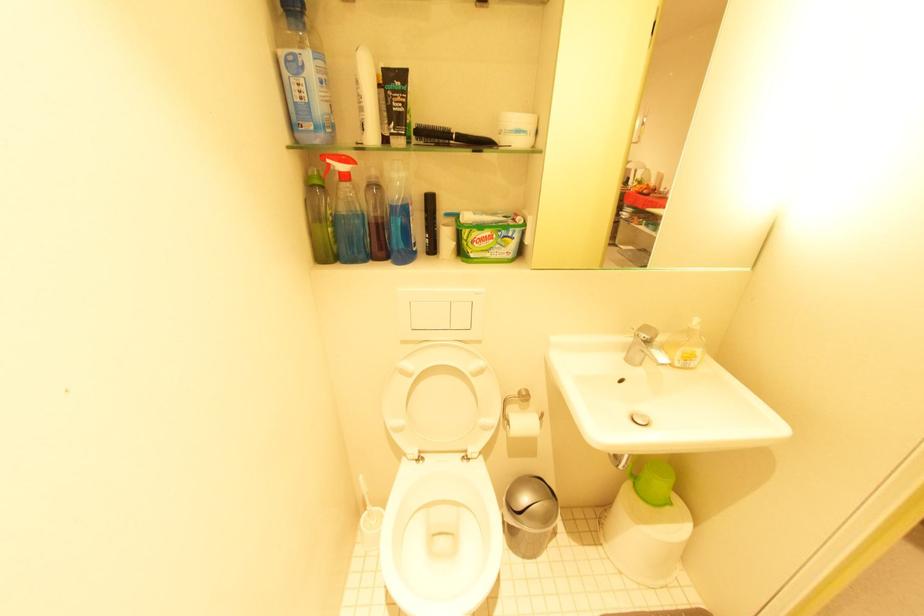
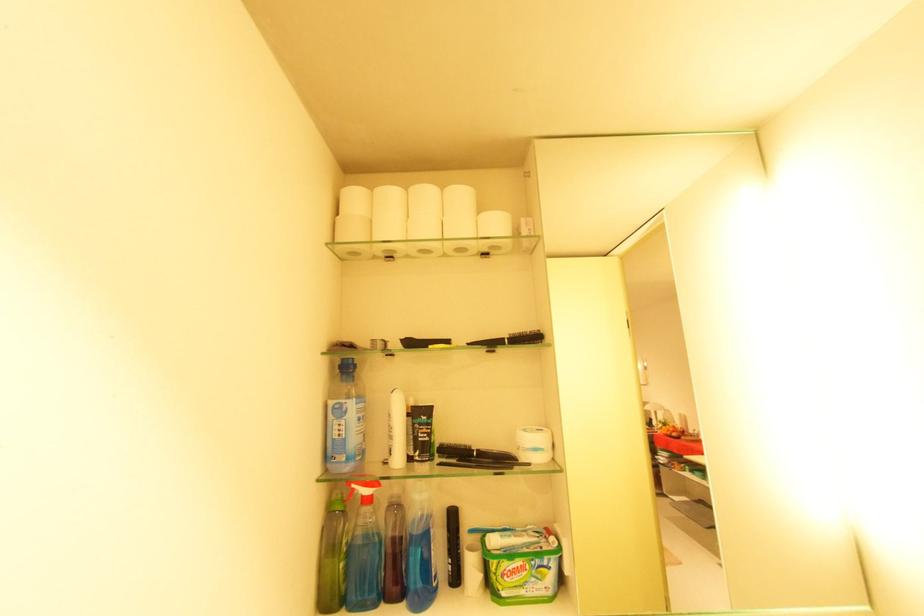
Locate, in the second image, the point that corresponds to (x=485, y=241) in the first image.

(517, 573)